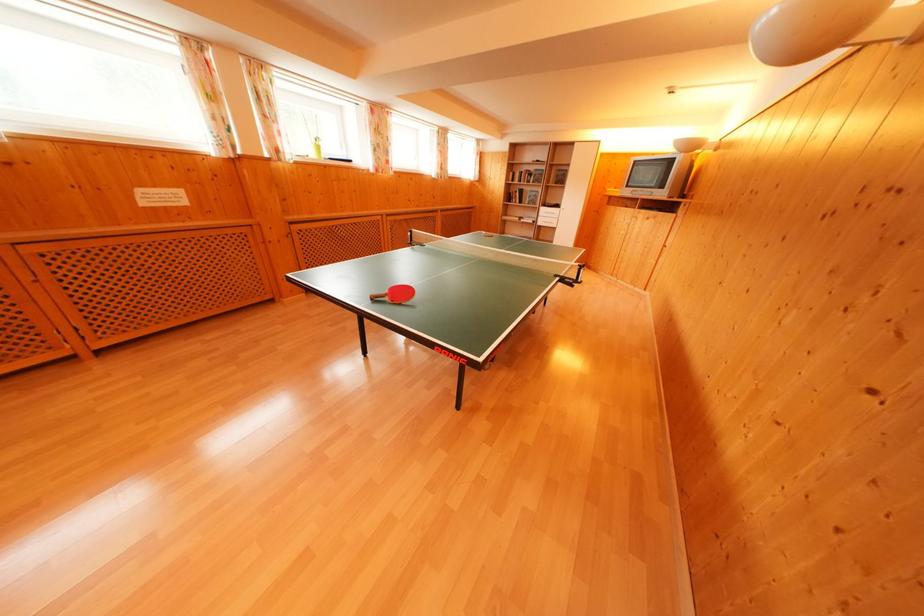
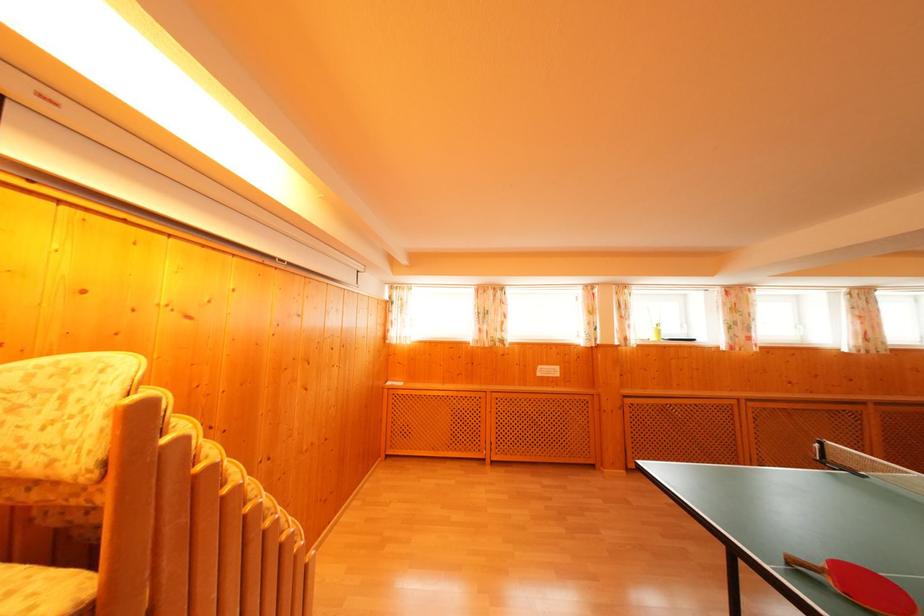
Locate, in the second image, the point that corresponds to (406,300) in the first image.

(870, 594)